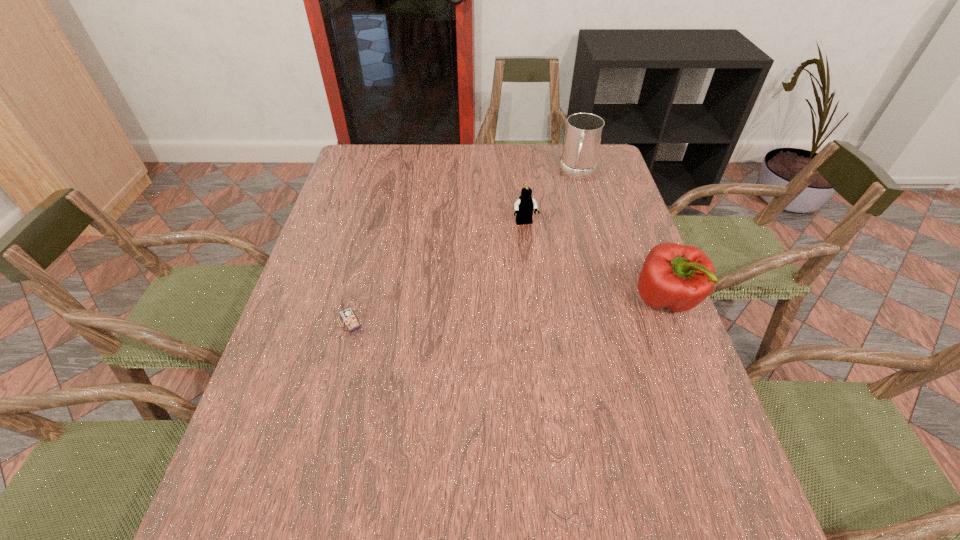
Locate an element on the screen. free space located on the front-facing side of the third nearest object is located at coordinates (547, 282).

I want to click on vacant region located 0.230m on the front-facing side of the third nearest object, so click(548, 285).

Identify the location of vacant point located on the front-facing side of the third nearest object. Image resolution: width=960 pixels, height=540 pixels. (x=548, y=285).

Locate an element on the screen. object at the far edge is located at coordinates (583, 133).

Where is `object that is at the left edge`? object that is at the left edge is located at coordinates (345, 313).

At what (x,y) coordinates should I click in order to perform the action: click on bell pepper present at the right edge. Please return your answer as a coordinate pair (x, y). Looking at the image, I should click on (679, 277).

Where is `mug that is at the right edge`? The width and height of the screenshot is (960, 540). mug that is at the right edge is located at coordinates (583, 133).

The image size is (960, 540). What are the coordinates of `object that is at the far right corner` in the screenshot? It's located at (583, 133).

Identify the location of vacant space at the far edge of the desktop. This screenshot has height=540, width=960. (416, 179).

You are a GUI agent. You are given a task and a screenshot of the screen. Output one action in this format:
    pyautogui.click(x=<x>, y=<y>)
    Task: Click on the vacant space at the near edge of the desktop
    
    Given the screenshot: What is the action you would take?
    pyautogui.click(x=337, y=448)